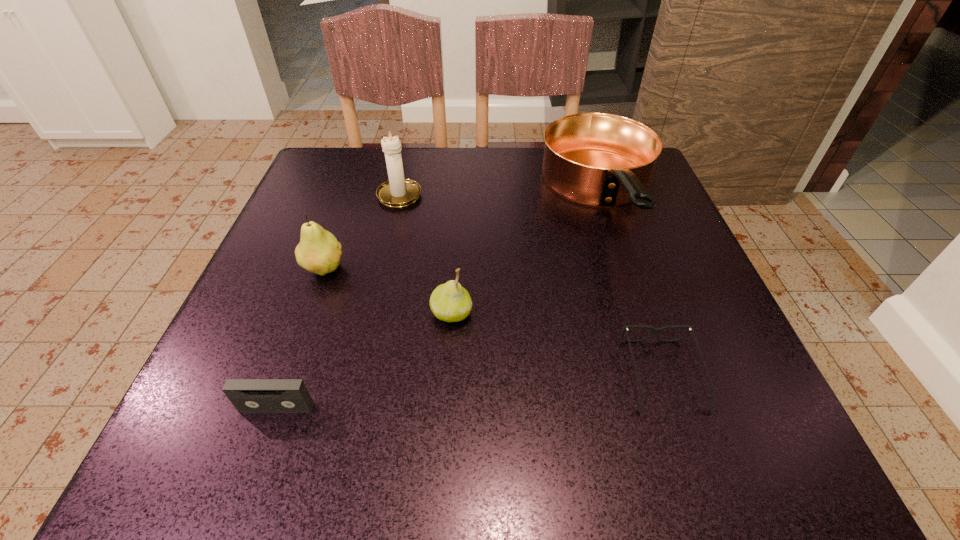
The height and width of the screenshot is (540, 960). In order to click on videotape present at the left edge in this screenshot , I will do `click(247, 395)`.

Where is `frying pan positioned at the right edge`? Image resolution: width=960 pixels, height=540 pixels. frying pan positioned at the right edge is located at coordinates (597, 159).

Locate an element on the screen. This screenshot has width=960, height=540. spectacles located in the right edge section of the desktop is located at coordinates (654, 330).

You are a GUI agent. You are given a task and a screenshot of the screen. Output one action in this format:
    pyautogui.click(x=<x>, y=<y>)
    Task: Click on the object that is at the near left corner
    The height and width of the screenshot is (540, 960).
    Given the screenshot: What is the action you would take?
    pyautogui.click(x=247, y=395)

Locate an element on the screen. The image size is (960, 540). object that is at the far right corner is located at coordinates (597, 159).

Identify the location of object situated at the near right corner. This screenshot has height=540, width=960. (654, 330).

In the image, there is a desktop. At what (x,y) coordinates should I click in order to perform the action: click on blank space at the far edge. Please return your answer as a coordinate pair (x, y). The width and height of the screenshot is (960, 540). Looking at the image, I should click on (408, 178).

In the image, there is a desktop. Where is `vacant space at the near edge`? vacant space at the near edge is located at coordinates (430, 423).

The height and width of the screenshot is (540, 960). In the image, there is a desktop. Identify the location of vacant space at the left edge. (283, 324).

In the image, there is a desktop. What are the coordinates of `vacant space at the right edge` in the screenshot? It's located at (726, 374).